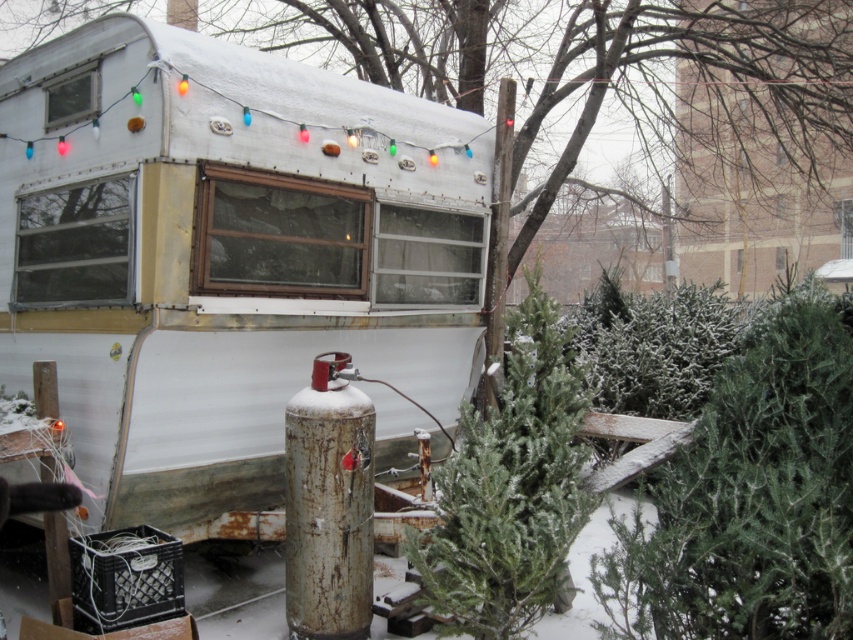
Can you confirm if white matte trailer at upper left is positioned to the right of green matte tree at center?

In fact, white matte trailer at upper left is to the left of green matte tree at center.

Is point (111, 150) positioned behind point (618, 378)?

No, it is in front of (618, 378).

Is point (192, 324) less distant than point (509, 29)?

Yes, it is.

This screenshot has width=853, height=640. Identify the location of white matte trailer at upper left. (224, 253).

Who is taller, green matte tree at center or green textured pine tree at center?

With more height is green matte tree at center.

Can you confirm if green matte tree at center is positioned below green textured pine tree at center?

No, green matte tree at center is not below green textured pine tree at center.

The height and width of the screenshot is (640, 853). Find the location of `green matte tree at center`. green matte tree at center is located at coordinates (708, 108).

Identify the location of green matte tree at center. (708, 108).

In the scene shown: Who is positioned more to the left, white matte trailer at upper left or green textured pine tree at center?

white matte trailer at upper left

What do you see at coordinates (224, 253) in the screenshot?
I see `white matte trailer at upper left` at bounding box center [224, 253].

You are a GUI agent. You are given a task and a screenshot of the screen. Output one action in this format:
    pyautogui.click(x=<x>, y=<y>)
    Task: Click on the white matte trailer at upper left
    The height and width of the screenshot is (640, 853).
    Given the screenshot: What is the action you would take?
    pyautogui.click(x=224, y=253)